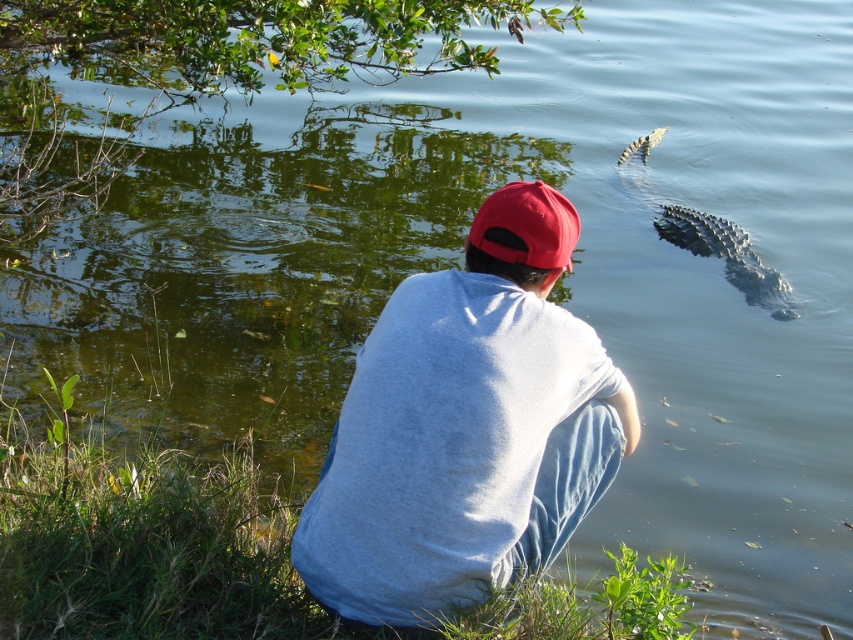
Who is higher up, gray cotton shirt at center or gray scaly crocodile at upper right?

gray scaly crocodile at upper right is higher up.

Describe the element at coordinates (466, 428) in the screenshot. This screenshot has height=640, width=853. I see `gray cotton shirt at center` at that location.

Where is `gray cotton shirt at center`? This screenshot has height=640, width=853. gray cotton shirt at center is located at coordinates (466, 428).

Between gray scaly crocodile at upper right and matte red cap at center, which one has less height?

matte red cap at center is shorter.

Does gray scaly crocodile at upper right appear under matte red cap at center?

Actually, gray scaly crocodile at upper right is above matte red cap at center.

The width and height of the screenshot is (853, 640). What do you see at coordinates (726, 256) in the screenshot?
I see `gray scaly crocodile at upper right` at bounding box center [726, 256].

This screenshot has height=640, width=853. Find the location of `gray scaly crocodile at upper right`. gray scaly crocodile at upper right is located at coordinates (726, 256).

Which is in front, point (538, 481) or point (526, 189)?

Positioned in front is point (526, 189).

Is point (375, 589) positioned in front of point (552, 244)?

Yes, point (375, 589) is in front of point (552, 244).

Identify the location of gray cotton shirt at center. The image size is (853, 640). (466, 428).